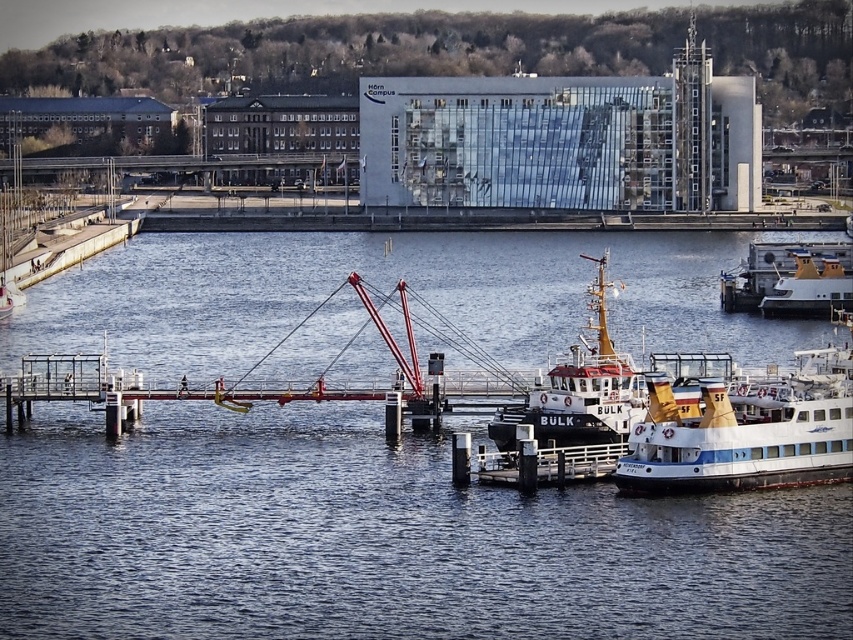
You are standing at the point marked as point (579, 388) in the image. Looking around, you see a yellow matte boat at center. Which direction should you face to look towards the yellow matte boat at center?

You are already facing the yellow matte boat at center because the point (579, 388) is on the yellow matte boat at center.

You are a photographer standing on the pier and want to capture both the blue water at center and the yellow matte boat at center in the same frame. Which object should you position closer to the left side of your camera viewfinder to ensure both are included?

To include both the blue water at center and the yellow matte boat at center in the same frame, position the blue water at center closer to the left side of your camera viewfinder since it is already on the left side of the yellow matte boat at center.